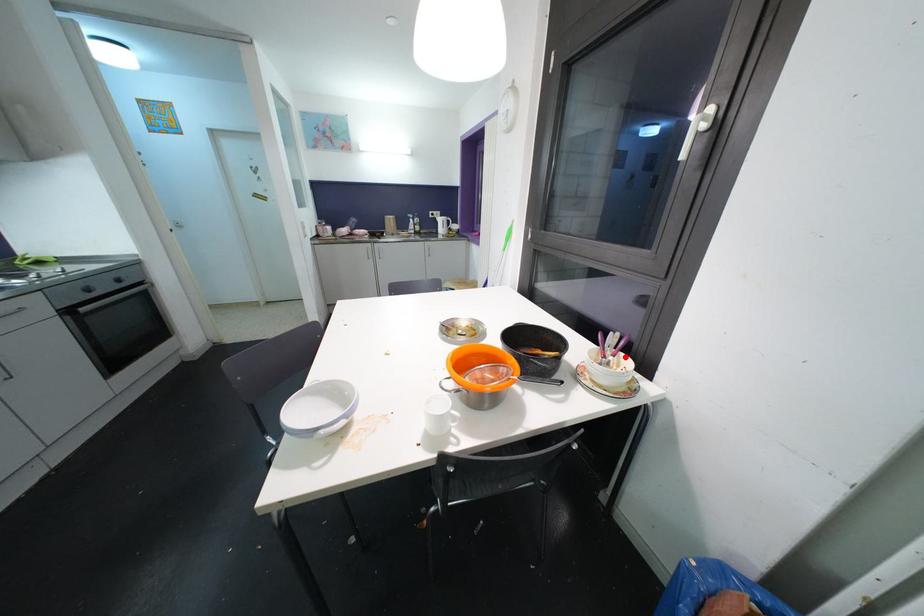
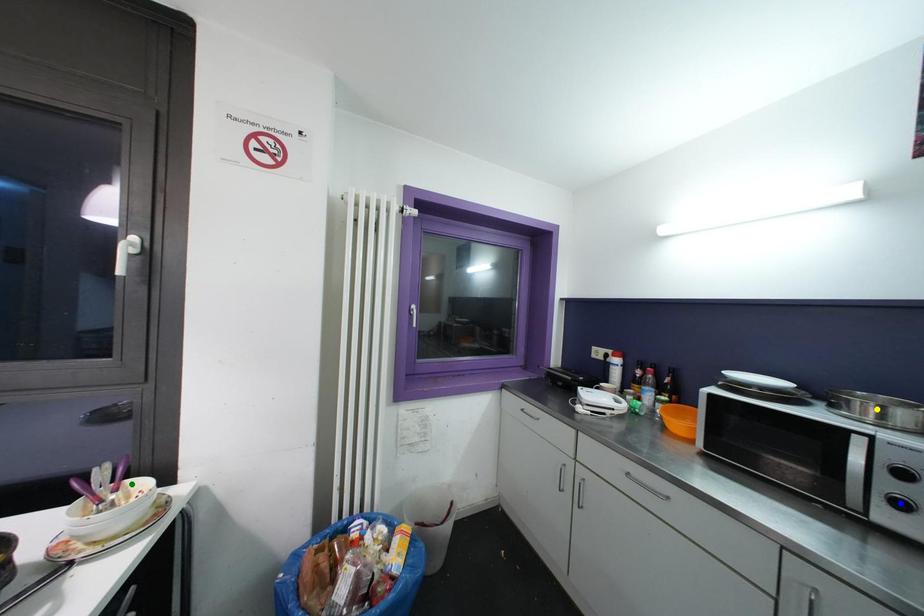
Question: I am providing you with two images of the same scene from different viewpoints. A red point is marked on the first image. You are given multiple points on the second image. Which point in image 2 represents the same 3d spot as the red point in image 1?

Choices:
 (A) yellow point
 (B) green point
 (C) blue point

Answer: (B)